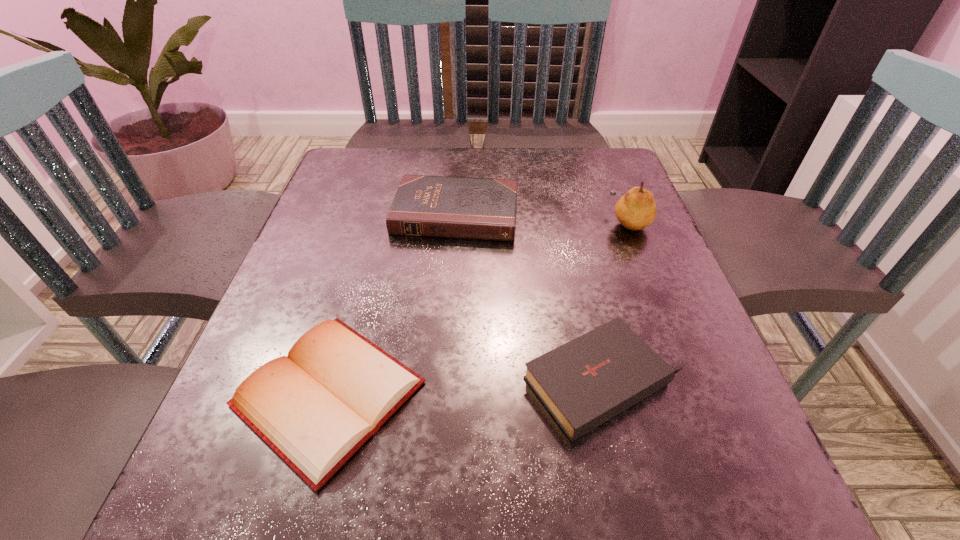
You are a GUI agent. You are given a task and a screenshot of the screen. Output one action in this format:
    pyautogui.click(x=<x>, y=<y>)
    Task: Click on the empty location between the farthest Bible and the shortest object
    The image size is (960, 540).
    Given the screenshot: What is the action you would take?
    (393, 303)

You are a GUI agent. You are given a task and a screenshot of the screen. Output one action in this format:
    pyautogui.click(x=<x>, y=<y>)
    Task: Click on the free space that is in between the shortest Bible and the farthest Bible
    This screenshot has width=960, height=540.
    Given the screenshot: What is the action you would take?
    pyautogui.click(x=393, y=303)

Find the location of a particular element. free space that is in between the shortest Bible and the pear is located at coordinates (479, 307).

Identify the location of free space between the farthest Bible and the shortest object. (393, 303).

Find the location of a particular element. object that is the closest one to the shortest Bible is located at coordinates (587, 381).

What are the coordinates of `object that is the second closest to the shortest object` in the screenshot? It's located at (430, 206).

Select which Bible is the third closest to the pear. Please provide its 2D coordinates. Your answer should be formatted as a tuple, i.e. [(x, y)], where the tuple contains the x and y coordinates of a point satisfying the conditions above.

[(315, 407)]

Identify which Bible is the second closest to the farthest Bible. Please provide its 2D coordinates. Your answer should be formatted as a tuple, i.e. [(x, y)], where the tuple contains the x and y coordinates of a point satisfying the conditions above.

[(587, 381)]